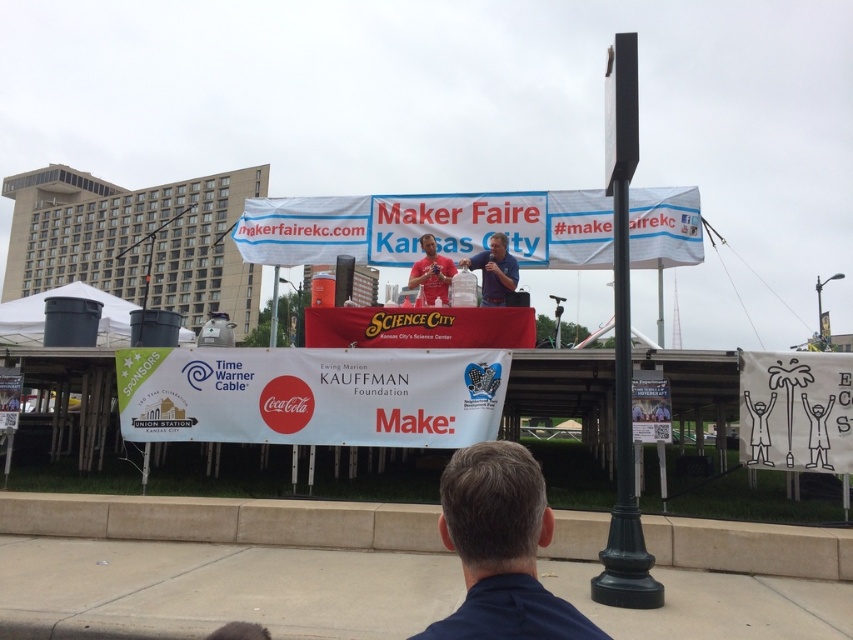
Can you confirm if dark blue shirt at lower center is positioned to the right of metallic pole at upper right?

Incorrect, dark blue shirt at lower center is not on the right side of metallic pole at upper right.

Between dark blue shirt at lower center and metallic pole at upper right, which one appears on the right side from the viewer's perspective?

metallic pole at upper right is more to the right.

Who is more distant from viewer, (457, 630) or (827, 340)?

Point (827, 340)

You are a GUI agent. You are given a task and a screenshot of the screen. Output one action in this format:
    pyautogui.click(x=<x>, y=<y>)
    Task: Click on the dark blue shirt at lower center
    
    Given the screenshot: What is the action you would take?
    pyautogui.click(x=500, y=548)

In the scene shown: Who is more forward, (381, 365) or (445, 193)?

Point (381, 365) is more forward.

Can you confirm if white paper banner at center is smaller than white fabric banner at upper center?

No.

Describe the element at coordinates (311, 396) in the screenshot. I see `white paper banner at center` at that location.

Locate an element on the screen. The height and width of the screenshot is (640, 853). white paper banner at center is located at coordinates (311, 396).

Between green painted metal pole at center and metallic pole at upper right, which one has more height?

green painted metal pole at center

Find the location of a particular element. green painted metal pole at center is located at coordinates (624, 344).